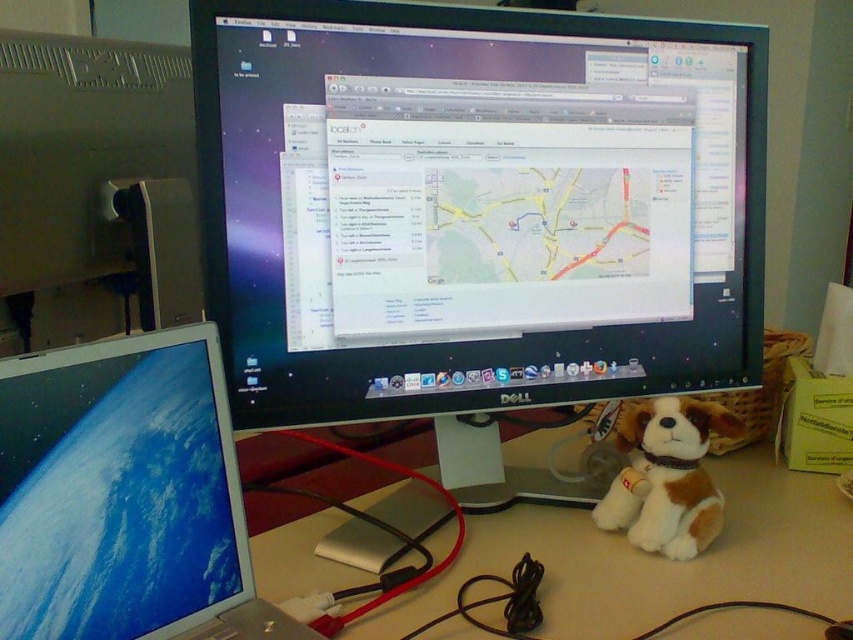
Question: Estimate the real-world distances between objects in this image. Which object is farther from the brown plush toy at lower right?

Choices:
 (A) matte gray desktop at left
 (B) matte plastic laptop at left
 (C) beige plastic computer desk at center
 (D) black glossy monitor at center

Answer: (A)

Question: Is beige plastic computer desk at center behind brown plush toy at lower right?

Choices:
 (A) no
 (B) yes

Answer: (A)

Question: Does black glossy monitor at center appear on the right side of brown plush toy at lower right?

Choices:
 (A) no
 (B) yes

Answer: (A)

Question: Estimate the real-world distances between objects in this image. Which object is closer to the beige plastic computer desk at center?

Choices:
 (A) matte plastic laptop at left
 (B) brown plush toy at lower right

Answer: (B)

Question: Among these objects, which one is farthest from the camera?

Choices:
 (A) matte plastic laptop at left
 (B) matte gray desktop at left
 (C) black glossy monitor at center
 (D) brown plush toy at lower right

Answer: (B)

Question: Can you confirm if black glossy monitor at center is bigger than brown plush toy at lower right?

Choices:
 (A) no
 (B) yes

Answer: (B)